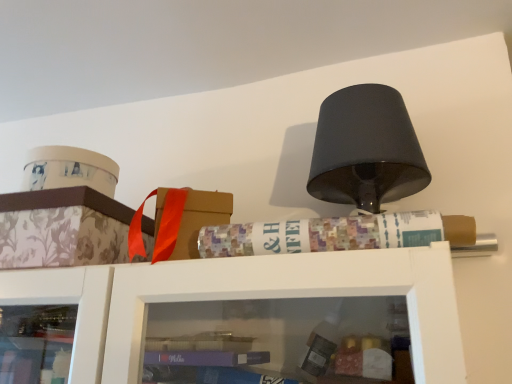
Question: From the image's perspective, is floral-patterned cardboard box at left located above or below multicolored paper at upper center?

Choices:
 (A) above
 (B) below

Answer: (B)

Question: Is point (133, 261) positioned closer to the camera than point (278, 231)?

Choices:
 (A) closer
 (B) farther

Answer: (B)

Question: In terms of width, does floral-patterned cardboard box at left look wider or thinner when compared to multicolored paper at upper center?

Choices:
 (A) wide
 (B) thin

Answer: (A)

Question: Relative to floral-patterned cardboard box at left, is multicolored paper at upper center in front or behind?

Choices:
 (A) behind
 (B) front

Answer: (B)

Question: From the image's perspective, is multicolored paper at upper center above or below floral-patterned cardboard box at left?

Choices:
 (A) below
 (B) above

Answer: (B)

Question: Considering the relative positions of multicolored paper at upper center and floral-patterned cardboard box at left in the image provided, is multicolored paper at upper center to the left or to the right of floral-patterned cardboard box at left?

Choices:
 (A) right
 (B) left

Answer: (A)

Question: In terms of height, does multicolored paper at upper center look taller or shorter compared to floral-patterned cardboard box at left?

Choices:
 (A) short
 (B) tall

Answer: (A)